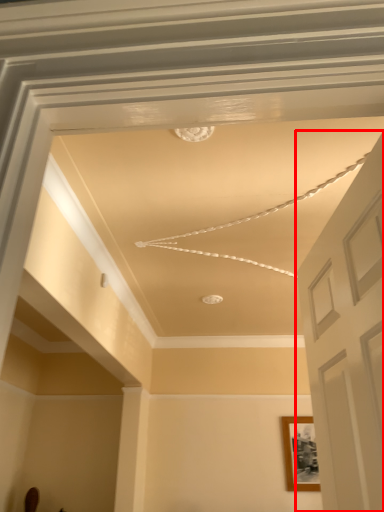
Question: From the image's perspective, where is door (annotated by the red box) located relative to picture frame?

Choices:
 (A) above
 (B) below

Answer: (A)